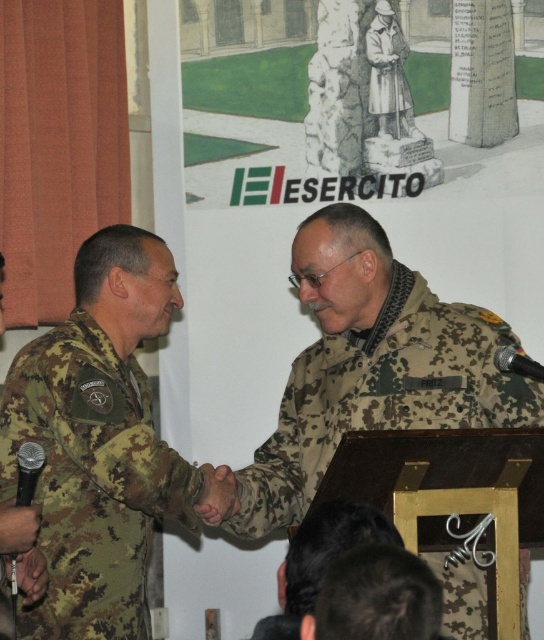
Is camouflage uniform at left above black metallic microphone at lower left?

Incorrect, camouflage uniform at left is not positioned above black metallic microphone at lower left.

Does camouflage uniform at left appear under black metallic microphone at lower left?

Yes, camouflage uniform at left is below black metallic microphone at lower left.

Image resolution: width=544 pixels, height=640 pixels. I want to click on camouflage uniform at left, so click(x=22, y=548).

Is point (299, 458) positioned after point (512, 371)?

Yes, point (299, 458) is farther from viewer.

Is camouflage fabric uniform at center above black matte microphone at right?

No.

What do you see at coordinates (381, 394) in the screenshot? This screenshot has width=544, height=640. I see `camouflage fabric uniform at center` at bounding box center [381, 394].

Where is `camouflage fabric uniform at center`? The image size is (544, 640). camouflage fabric uniform at center is located at coordinates (381, 394).

Between camouflage fabric uniform at left and camouflage fabric uniform at center, which one has less height?

camouflage fabric uniform at center is shorter.

Describe the element at coordinates (90, 481) in the screenshot. This screenshot has width=544, height=640. I see `camouflage fabric uniform at left` at that location.

Locate an element on the screen. camouflage fabric uniform at left is located at coordinates (90, 481).